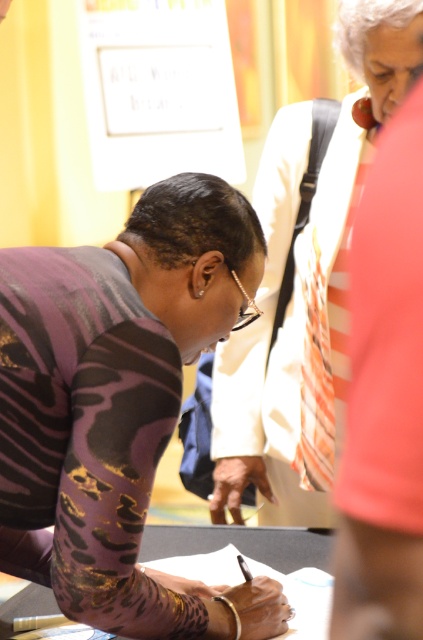
Is purple metallic shirt at center thinner than matte purple blouse at center?

No.

Between purple metallic shirt at center and matte purple blouse at center, which one appears on the left side from the viewer's perspective?

From the viewer's perspective, purple metallic shirt at center appears more on the left side.

Who is more forward, (13, 449) or (257, 173)?

Point (13, 449) is in front.

I want to click on purple metallic shirt at center, so click(120, 404).

Is matte purple blouse at center below smooth black paper at center?

No, matte purple blouse at center is not below smooth black paper at center.

Which is more to the right, matte purple blouse at center or smooth black paper at center?

matte purple blouse at center

Locate an element on the screen. The width and height of the screenshot is (423, 640). matte purple blouse at center is located at coordinates (307, 288).

Who is positioned more to the left, purple metallic shirt at center or smooth black paper at center?

purple metallic shirt at center is more to the left.

Is point (143, 497) closer to camera compared to point (302, 621)?

Yes.

At what (x,y) coordinates should I click in order to perform the action: click on purple metallic shirt at center. Please return your answer as a coordinate pair (x, y). This screenshot has height=640, width=423. Looking at the image, I should click on (120, 404).